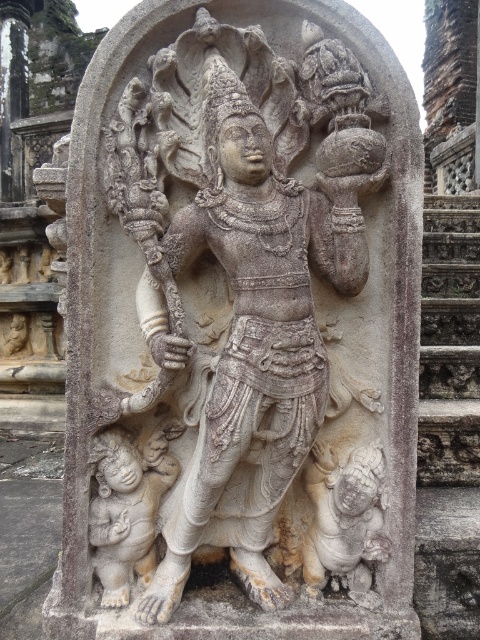
Is gray stone statue at center taller than smooth beige statue at lower left?

Yes.

Between gray stone statue at center and smooth beige statue at lower left, which one is positioned lower?

Positioned lower is smooth beige statue at lower left.

At what (x,y) coordinates should I click in order to perform the action: click on gray stone statue at center. Please return your answer as a coordinate pair (x, y). Image resolution: width=480 pixels, height=640 pixels. Looking at the image, I should click on (255, 337).

The height and width of the screenshot is (640, 480). Identify the location of gray stone stairs at center. (448, 420).

Which is behind, point (456, 230) or point (112, 588)?

Point (456, 230)

In order to click on gray stone stairs at center in this screenshot , I will do `click(448, 420)`.

Can you confirm if gray stone statue at center is taller than gray stone stairs at center?

No.

Does gray stone statue at center have a lesser height compared to gray stone stairs at center?

Correct, gray stone statue at center is not as tall as gray stone stairs at center.

At what (x,y) coordinates should I click in order to perform the action: click on gray stone statue at center. Please return your answer as a coordinate pair (x, y). This screenshot has width=480, height=640. Looking at the image, I should click on (255, 337).